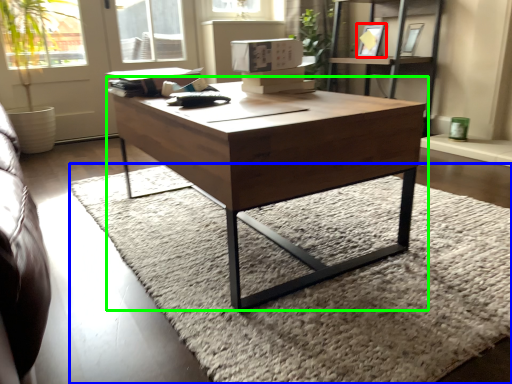
Question: Which is farther away from picture frame (highlighted by a red box)? mat (highlighted by a blue box) or coffee table (highlighted by a green box)?

Choices:
 (A) mat
 (B) coffee table

Answer: (B)